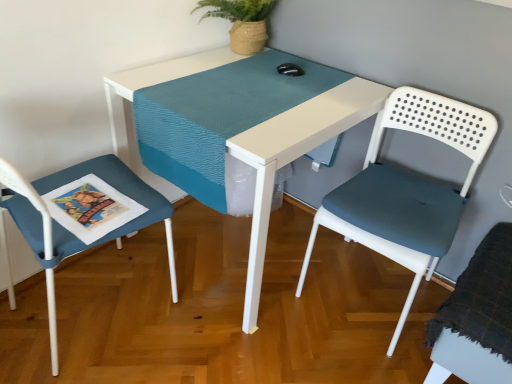
Question: Can you confirm if textured blue cushion at left, arranged as the 1th chair when viewed from the left, is bigger than teal woven runner at center?

Choices:
 (A) yes
 (B) no

Answer: (A)

Question: Considering the relative positions of textured blue cushion at left, arranged as the 1th chair when viewed from the left, and teal woven runner at center in the image provided, is textured blue cushion at left, arranged as the 1th chair when viewed from the left, to the left of teal woven runner at center from the viewer's perspective?

Choices:
 (A) no
 (B) yes

Answer: (B)

Question: Considering the relative sizes of textured blue cushion at left, which is the third chair from right to left, and teal woven runner at center in the image provided, is textured blue cushion at left, which is the third chair from right to left, taller than teal woven runner at center?

Choices:
 (A) no
 (B) yes

Answer: (B)

Question: Does textured blue cushion at left, arranged as the 1th chair when viewed from the left, have a smaller size compared to teal woven runner at center?

Choices:
 (A) no
 (B) yes

Answer: (A)

Question: Can we say textured blue cushion at left, which is the third chair from right to left, lies outside teal woven runner at center?

Choices:
 (A) yes
 (B) no

Answer: (A)

Question: From the image's perspective, is textured blue cushion at left, arranged as the 1th chair when viewed from the left, beneath teal woven runner at center?

Choices:
 (A) no
 (B) yes

Answer: (B)

Question: Can you see textured blue cushion at left, arranged as the 1th chair when viewed from the left, touching white plastic chair at right, which appears as the 2th chair when viewed from the left?

Choices:
 (A) no
 (B) yes

Answer: (A)

Question: Considering the relative sizes of textured blue cushion at left, arranged as the 1th chair when viewed from the left, and white plastic chair at right, which appears as the second chair when viewed from the right, in the image provided, is textured blue cushion at left, arranged as the 1th chair when viewed from the left, thinner than white plastic chair at right, which appears as the second chair when viewed from the right,?

Choices:
 (A) no
 (B) yes

Answer: (A)

Question: Does textured blue cushion at left, arranged as the 1th chair when viewed from the left, lie in front of white plastic chair at right, which appears as the 2th chair when viewed from the left?

Choices:
 (A) yes
 (B) no

Answer: (A)

Question: Does textured blue cushion at left, arranged as the 1th chair when viewed from the left, appear on the left side of white plastic chair at right, which appears as the second chair when viewed from the right?

Choices:
 (A) no
 (B) yes

Answer: (B)

Question: From the image's perspective, is textured blue cushion at left, which is the third chair from right to left, on top of white plastic chair at right, which appears as the second chair when viewed from the right?

Choices:
 (A) no
 (B) yes

Answer: (A)

Question: Is textured blue cushion at left, which is the third chair from right to left, completely or partially outside of white plastic chair at right, which appears as the second chair when viewed from the right?

Choices:
 (A) yes
 (B) no

Answer: (A)

Question: Considering the relative positions of teal woven runner at center and white plastic chair at right, which appears as the 2th chair when viewed from the left, in the image provided, is teal woven runner at center behind white plastic chair at right, which appears as the 2th chair when viewed from the left,?

Choices:
 (A) no
 (B) yes

Answer: (B)